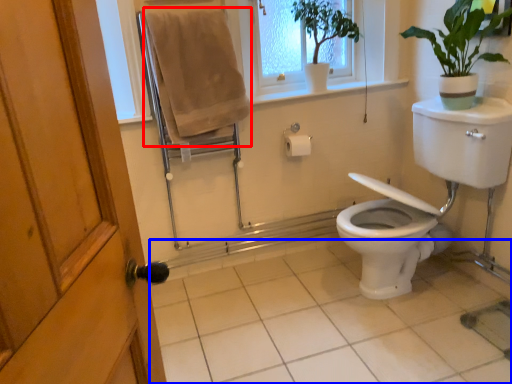
Question: Which object appears closest to the camera in this image, bath towel (highlighted by a red box) or tile (highlighted by a blue box)?

Choices:
 (A) bath towel
 (B) tile

Answer: (B)